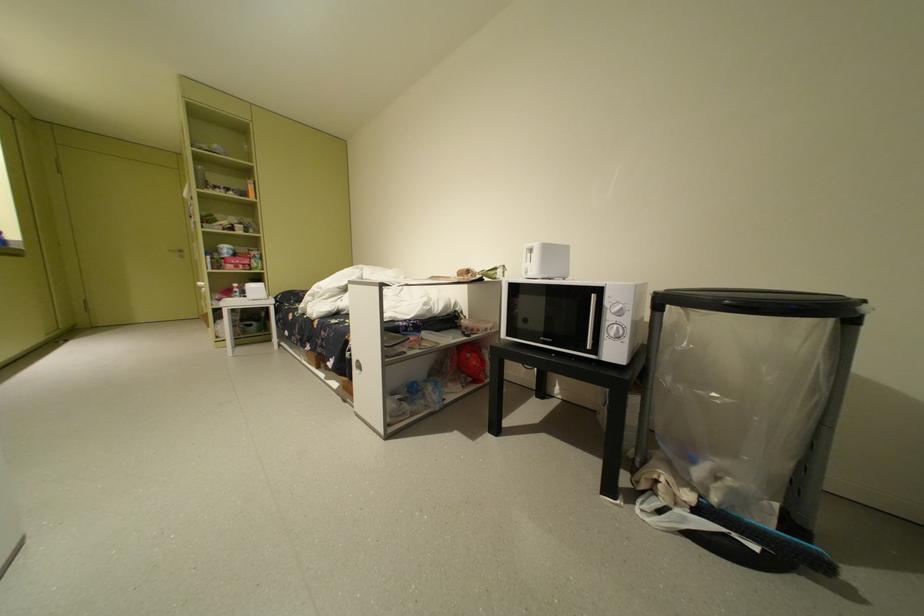
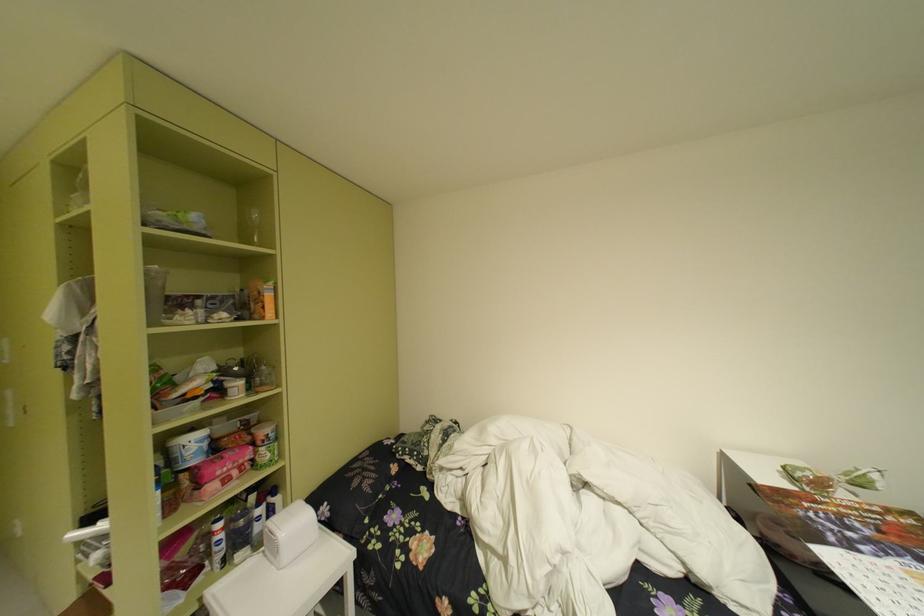
In a continuous first-person perspective shot, in which direction is the camera moving?

The cameraman moved toward left, forward.